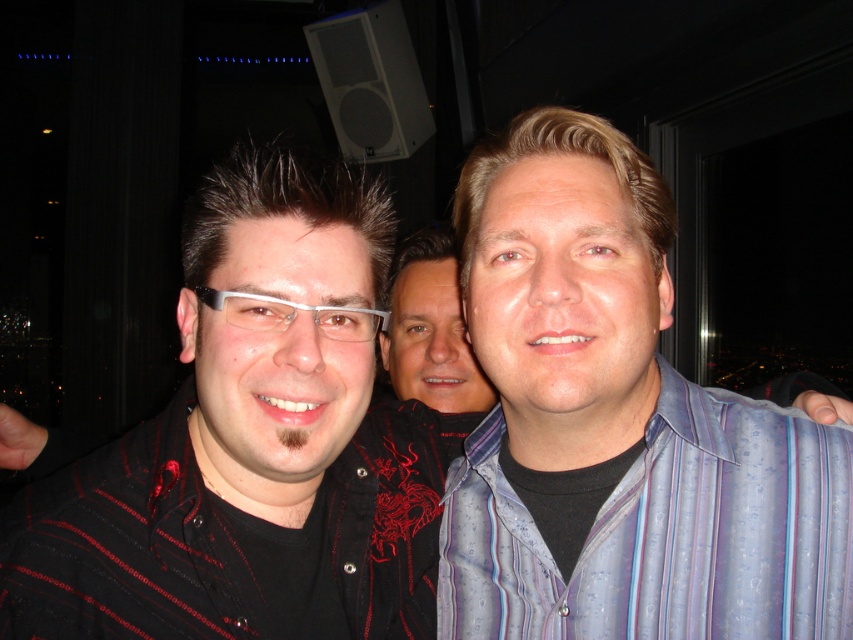
Where is `smooth black shirt at center`? smooth black shirt at center is located at coordinates (430, 330).

Is point (412, 392) behind point (376, 310)?

That is True.

Where is `smooth black shirt at center`? The width and height of the screenshot is (853, 640). smooth black shirt at center is located at coordinates (430, 330).

How distant is striped cotton shirt at right from smooth black shirt at center?

striped cotton shirt at right is 19.52 inches away from smooth black shirt at center.

Measure the distance between striped cotton shirt at right and camera.

The distance of striped cotton shirt at right from camera is 68.11 centimeters.

The image size is (853, 640). In order to click on striped cotton shirt at right in this screenshot , I will do `click(665, 532)`.

Which is above, striped cotton shirt at right or white plastic glasses at center?

Positioned higher is white plastic glasses at center.

Can you confirm if striped cotton shirt at right is positioned to the right of white plastic glasses at center?

Correct, you'll find striped cotton shirt at right to the right of white plastic glasses at center.

Is point (753, 577) positioned in front of point (340, 307)?

No, it is behind (340, 307).

Find the location of `striped cotton shirt at right`. striped cotton shirt at right is located at coordinates (665, 532).